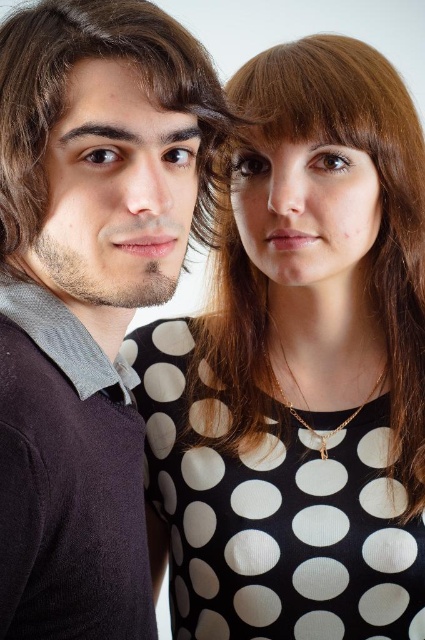
Question: Which point is closer to the camera?

Choices:
 (A) brown silky hair at upper right
 (B) brown matte hair at left

Answer: (B)

Question: Among these points, which one is nearest to the camera?

Choices:
 (A) (x=353, y=108)
 (B) (x=161, y=22)

Answer: (B)

Question: Does brown silky hair at upper right lie behind brown matte hair at left?

Choices:
 (A) yes
 (B) no

Answer: (A)

Question: Is brown silky hair at upper right thinner than brown matte hair at left?

Choices:
 (A) no
 (B) yes

Answer: (A)

Question: Is brown silky hair at upper right in front of brown matte hair at left?

Choices:
 (A) no
 (B) yes

Answer: (A)